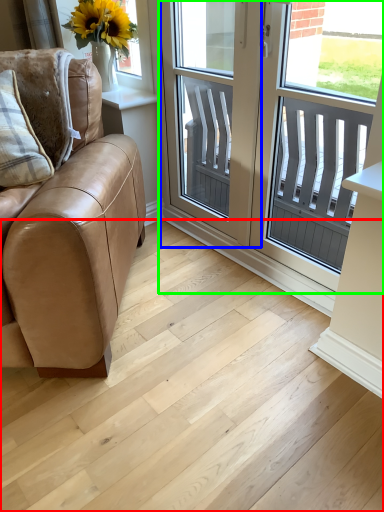
Question: Which object is the closest to the stairwell (highlighted by a red box)? Choose among these: screen door (highlighted by a blue box) or window (highlighted by a green box).

Choices:
 (A) screen door
 (B) window

Answer: (A)